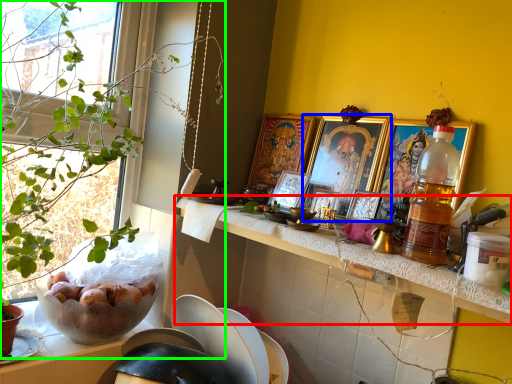
Question: Based on their relative distances, which object is farther from countertop (highlighted by a red box)? Choose from picture frame (highlighted by a blue box) and houseplant (highlighted by a green box).

Choices:
 (A) picture frame
 (B) houseplant

Answer: (B)